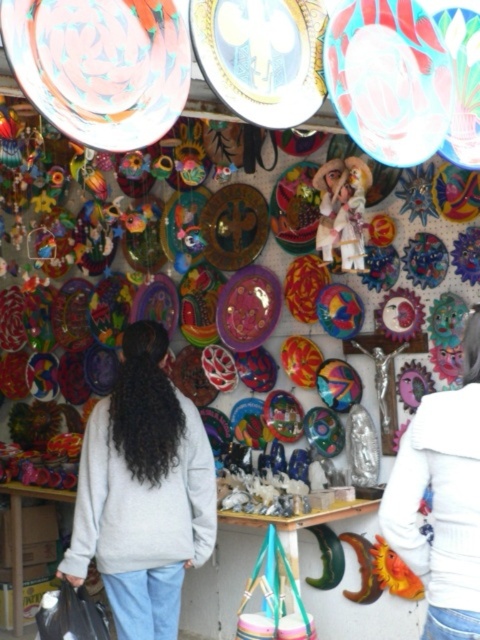
Looking at this image, you are a customer at the market stall and want to know if the two plates, the matte ceramic plate at center and the shiny purple plate at center, are close enough to touch with one hand. The average human hand can reach about 0.5 meters. Can you determine this?

The matte ceramic plate at center is 2.03 meters away from the shiny purple plate at center, which is much farther than the average human hand reach of 0.5 meters. Therefore, you cannot touch both plates with one hand.

You are standing at the entrance of the market stall and want to reach the two points displayed in the scene. The first point is at coordinates point (x=168, y=116) and the second is at point (x=358, y=124). Which point is closer to you?

Point (x=168, y=116) is in front of point (x=358, y=124), so it is closer to you.

Looking at the market stall, you notice two plates displayed on the wall. The first is a matte multicolored plate at upper center, and the second is a matte ceramic plate at center. Which of these two plates is taller?

The matte multicolored plate at upper center is taller than the matte ceramic plate at center.